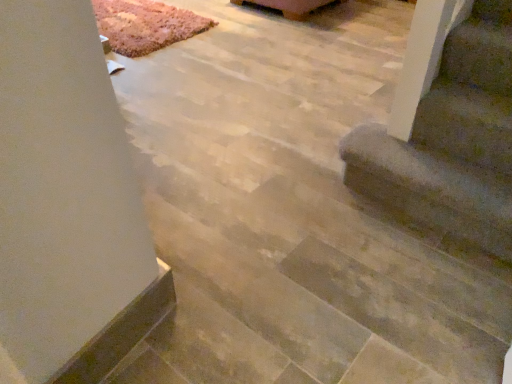
Question: Should I look upward or downward to see rug carpet at upper left?

Choices:
 (A) up
 (B) down

Answer: (A)

Question: From the image's perspective, is rug carpet at upper left on top of brown fuzzy carpet at lower right?

Choices:
 (A) yes
 (B) no

Answer: (A)

Question: Can you confirm if rug carpet at upper left is wider than brown fuzzy carpet at lower right?

Choices:
 (A) yes
 (B) no

Answer: (A)

Question: From a real-world perspective, is rug carpet at upper left under brown fuzzy carpet at lower right?

Choices:
 (A) no
 (B) yes

Answer: (B)

Question: Is rug carpet at upper left touching brown fuzzy carpet at lower right?

Choices:
 (A) yes
 (B) no

Answer: (B)

Question: Does rug carpet at upper left have a lesser width compared to brown fuzzy carpet at lower right?

Choices:
 (A) yes
 (B) no

Answer: (B)

Question: From the image's perspective, is rug carpet at upper left beneath brown fuzzy carpet at lower right?

Choices:
 (A) yes
 (B) no

Answer: (B)

Question: Considering the relative sizes of rug carpet at upper left and wooden coffee table at upper center in the image provided, is rug carpet at upper left thinner than wooden coffee table at upper center?

Choices:
 (A) no
 (B) yes

Answer: (A)

Question: Is rug carpet at upper left positioned with its back to wooden coffee table at upper center?

Choices:
 (A) yes
 (B) no

Answer: (B)

Question: Is rug carpet at upper left far away from wooden coffee table at upper center?

Choices:
 (A) yes
 (B) no

Answer: (B)

Question: Is rug carpet at upper left smaller than wooden coffee table at upper center?

Choices:
 (A) yes
 (B) no

Answer: (A)

Question: Is rug carpet at upper left positioned in front of wooden coffee table at upper center?

Choices:
 (A) yes
 (B) no

Answer: (A)

Question: Is rug carpet at upper left facing towards wooden coffee table at upper center?

Choices:
 (A) yes
 (B) no

Answer: (A)

Question: Does brown fuzzy carpet at lower right have a larger size compared to rug carpet at upper left?

Choices:
 (A) yes
 (B) no

Answer: (B)